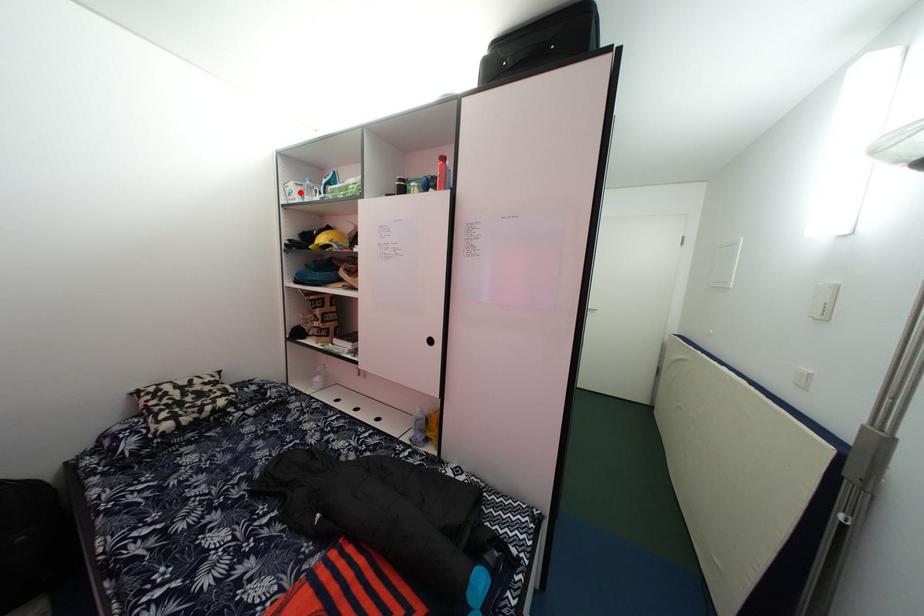
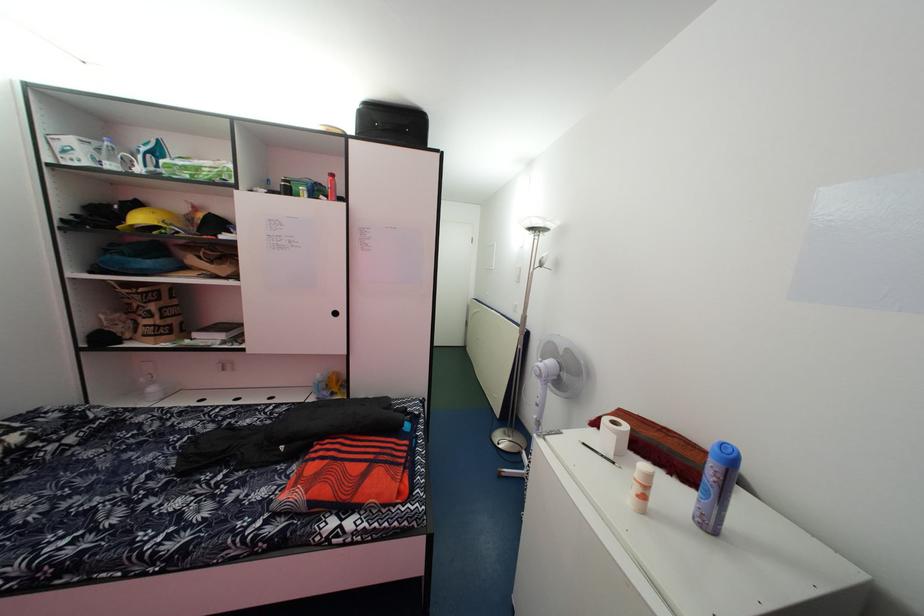
Where in the second image is the point corresponding to the highlighted location from the first image?

(79, 148)